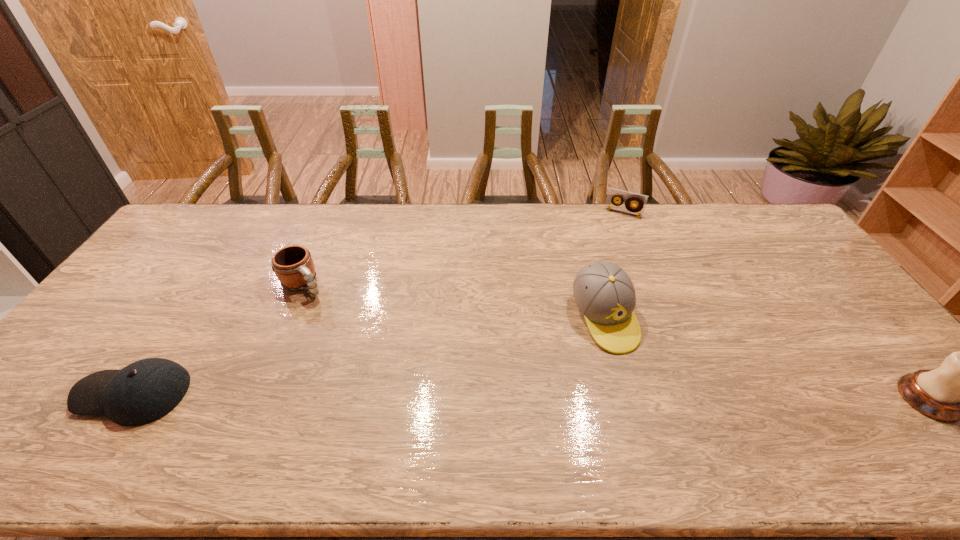
Locate an element on the screen. The height and width of the screenshot is (540, 960). free space located on the side of the mug with the handle is located at coordinates (326, 310).

This screenshot has width=960, height=540. I want to click on vacant space located 0.310m on the side of the mug with the handle, so click(373, 358).

At what (x,y) coordinates should I click in order to perform the action: click on vacant space positioned 0.220m on the side of the mug with the handle. Please return your answer as a coordinate pair (x, y). Looking at the image, I should click on 355,339.

Locate an element on the screen. Image resolution: width=960 pixels, height=540 pixels. free space located on the front-facing side of the right baseball cap is located at coordinates (642, 392).

What are the coordinates of `vacant space situated on the front-facing side of the right baseball cap` in the screenshot? It's located at (642, 392).

I want to click on blank space located 0.080m on the front-facing side of the right baseball cap, so click(x=635, y=379).

Image resolution: width=960 pixels, height=540 pixels. Identify the location of object located at the far edge. tap(640, 200).

I want to click on object located at the near edge, so click(x=142, y=392).

Locate an element on the screen. object at the left edge is located at coordinates (142, 392).

This screenshot has height=540, width=960. Identify the location of object located at the near left corner. (142, 392).